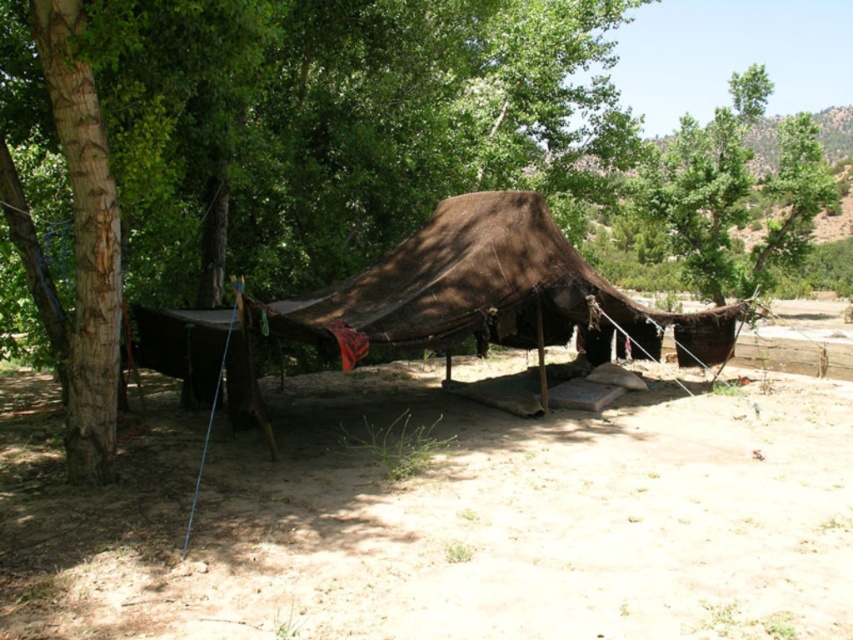
Is brown dirt field at center smaller than brown canvas tent at center?

Incorrect, brown dirt field at center is not smaller in size than brown canvas tent at center.

Which is more to the right, brown dirt field at center or brown canvas tent at center?

brown dirt field at center is more to the right.

Which is in front, point (15, 627) or point (152, 339)?

Point (15, 627)

At what (x,y) coordinates should I click in order to perform the action: click on brown dirt field at center. Please return your answer as a coordinate pair (x, y). Image resolution: width=853 pixels, height=640 pixels. Looking at the image, I should click on (x=442, y=518).